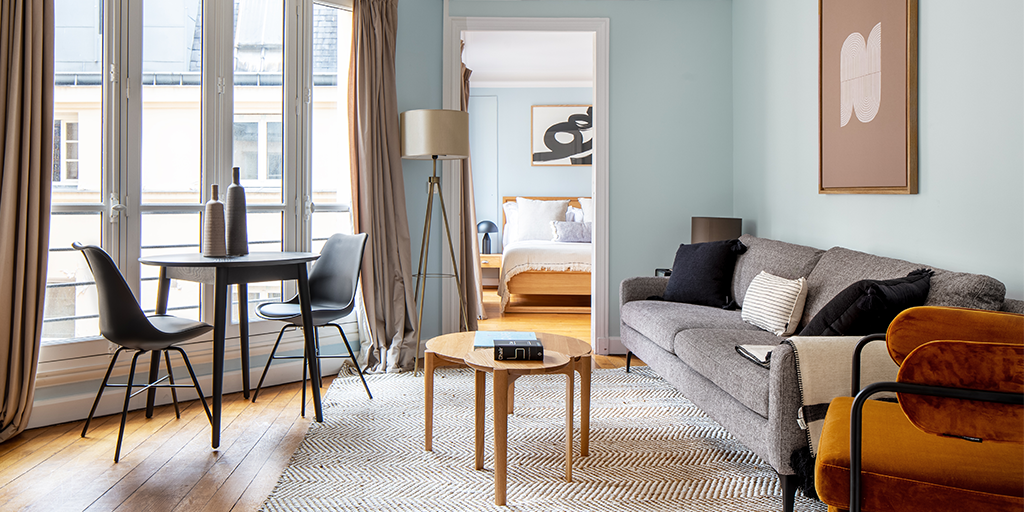
Identify the location of sofa. The image size is (1024, 512). (699, 350).